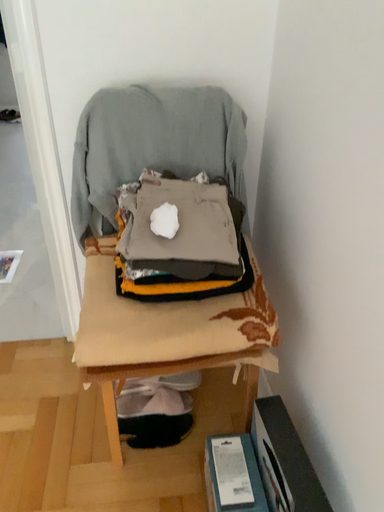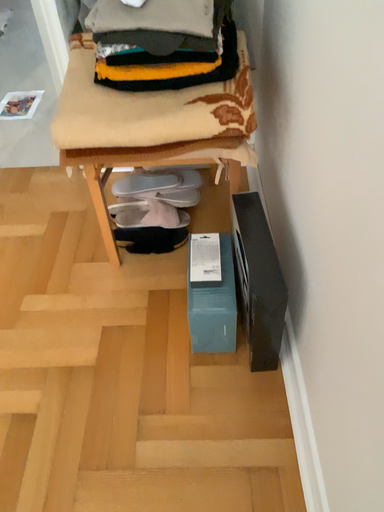
Question: Which way did the camera rotate in the video?

Choices:
 (A) rotated upward
 (B) rotated downward

Answer: (B)